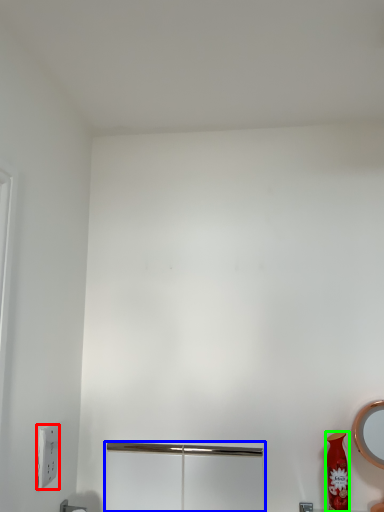
Question: Based on their relative distances, which object is nearer to light switch (highlighted by a red box)? Choose from screen door (highlighted by a blue box) and vase (highlighted by a green box).

Choices:
 (A) screen door
 (B) vase

Answer: (A)